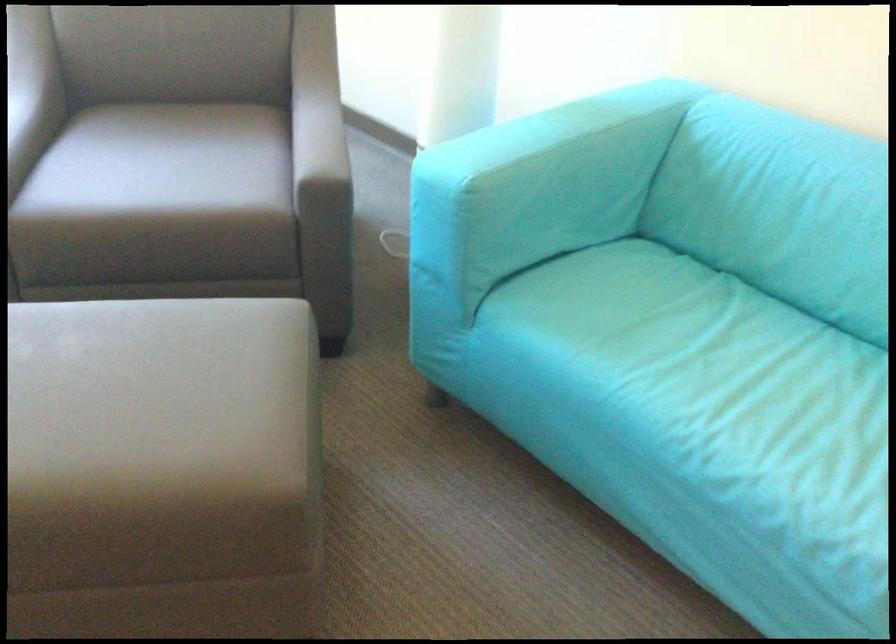
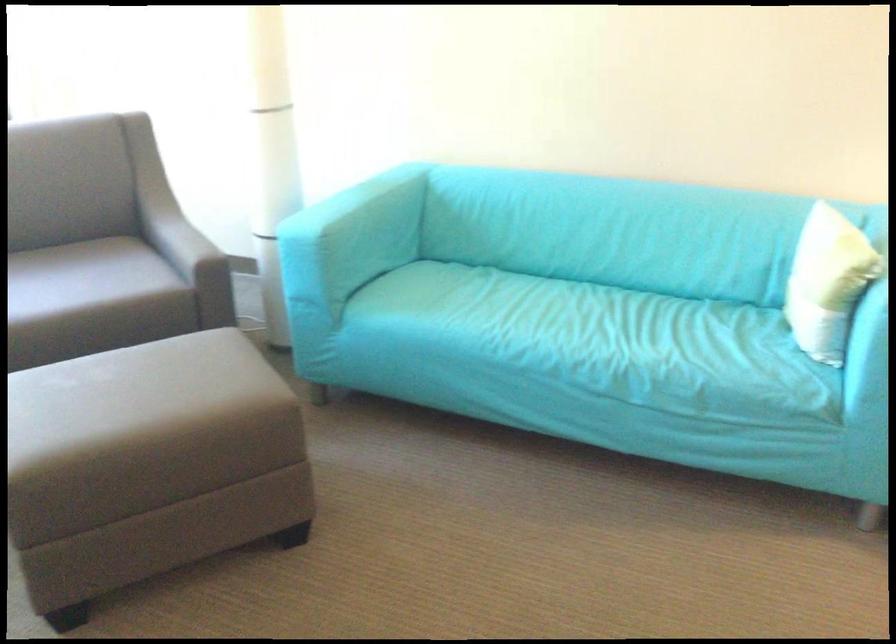
Where in the second image is the point corresponding to point (134, 192) from the first image?

(53, 298)